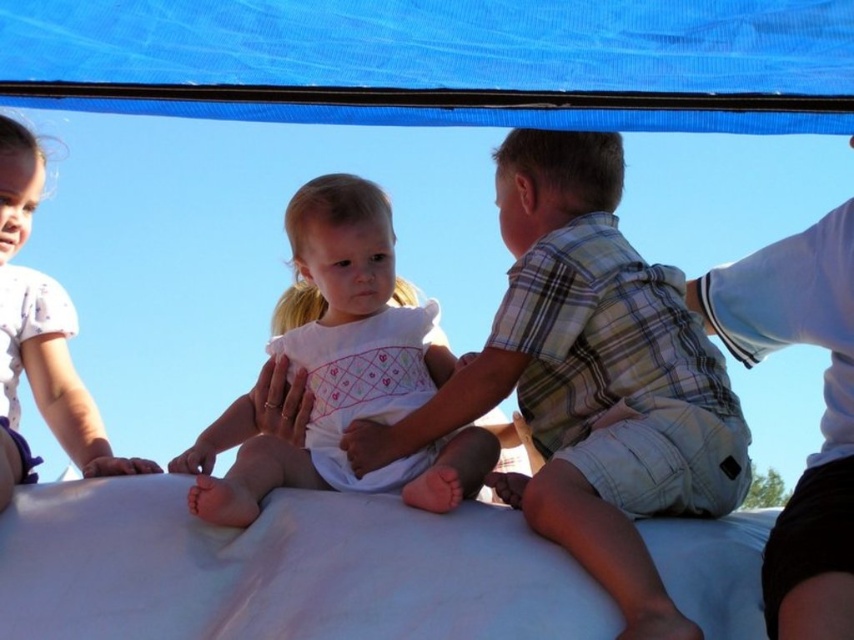
Can you confirm if blue fabric canopy at upper center is wider than plaid cotton shirt at center?

Yes, blue fabric canopy at upper center is wider than plaid cotton shirt at center.

Is point (626, 4) behind point (703, 452)?

Yes.

This screenshot has height=640, width=854. Identify the location of blue fabric canopy at upper center. (442, 61).

Based on the photo, between plaid cotton shirt at center and white cotton dress at center, which one has less height?

Standing shorter between the two is white cotton dress at center.

Is point (629, 612) positioned in front of point (425, 506)?

Yes, it is in front of point (425, 506).

Find the location of a particular element. plaid cotton shirt at center is located at coordinates (589, 378).

Between white cotton dress at center and white cotton shirt at left, which one appears on the right side from the viewer's perspective?

Positioned to the right is white cotton dress at center.

Between white cotton dress at center and white cotton shirt at left, which one is positioned higher?

white cotton shirt at left is above.

Locate an element on the screen. This screenshot has width=854, height=640. white cotton dress at center is located at coordinates 342,371.